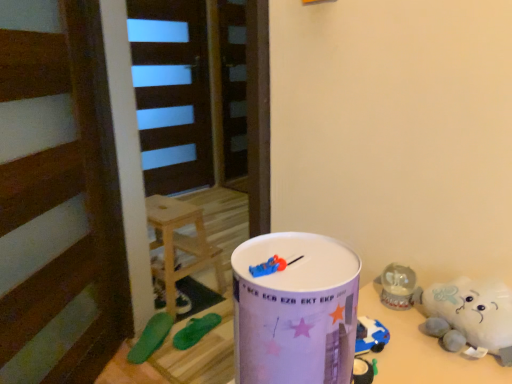
The image size is (512, 384). Describe the element at coordinates (179, 250) in the screenshot. I see `wooden stool at center` at that location.

Describe the element at coordinates (151, 337) in the screenshot. I see `green rubber toy at lower left, which ranks as the first toy in front-to-back order` at that location.

This screenshot has height=384, width=512. I want to click on green rubber toy at lower left, which is the 1th toy in back-to-front order, so click(x=159, y=294).

From the picture: Is white glossy milk can at center to the right of green rubber toy at lower left, marked as the third toy in a back-to-front arrangement, from the viewer's perspective?

Correct, you'll find white glossy milk can at center to the right of green rubber toy at lower left, marked as the third toy in a back-to-front arrangement.

Is white glossy milk can at center aimed at green rubber toy at lower left, marked as the third toy in a back-to-front arrangement?

No, white glossy milk can at center is not aimed at green rubber toy at lower left, marked as the third toy in a back-to-front arrangement.

From a real-world perspective, is white glossy milk can at center positioned under green rubber toy at lower left, which ranks as the first toy in front-to-back order, based on gravity?

No, from a real-world perspective, white glossy milk can at center is not under green rubber toy at lower left, which ranks as the first toy in front-to-back order.

Is white plush toy at lower right positioned beyond the bounds of white glossy milk can at center?

Yes, white plush toy at lower right is located beyond the bounds of white glossy milk can at center.

Considering the relative sizes of white plush toy at lower right and white glossy milk can at center in the image provided, is white plush toy at lower right taller than white glossy milk can at center?

No.

Considering the sizes of objects wooden stool at center and white glossy milk can at center in the image provided, who is bigger, wooden stool at center or white glossy milk can at center?

With larger size is wooden stool at center.

Is point (188, 300) closer to viewer compared to point (340, 263)?

No, (188, 300) is further to viewer.

Looking at this image, in terms of width, does wooden stool at center look wider or thinner when compared to white glossy milk can at center?

In the image, wooden stool at center appears to be wider than white glossy milk can at center.

Considering the positions of objects green rubber toy at lower left, which is the 1th toy in back-to-front order, and green rubber toy at lower left, marked as the third toy in a back-to-front arrangement, in the image provided, who is in front, green rubber toy at lower left, which is the 1th toy in back-to-front order, or green rubber toy at lower left, marked as the third toy in a back-to-front arrangement,?

green rubber toy at lower left, marked as the third toy in a back-to-front arrangement, is in front.

Would you say green rubber toy at lower left, which is the 1th toy in back-to-front order, contains green rubber toy at lower left, marked as the third toy in a back-to-front arrangement?

No, green rubber toy at lower left, marked as the third toy in a back-to-front arrangement, is not a part of green rubber toy at lower left, which is the 1th toy in back-to-front order.

From a real-world perspective, is green rubber toy at lower left, which is the 1th toy in back-to-front order, on green rubber toy at lower left, which ranks as the first toy in front-to-back order?

No, from a real-world perspective, green rubber toy at lower left, which is the 1th toy in back-to-front order, is not over green rubber toy at lower left, which ranks as the first toy in front-to-back order

Is green rubber toy at lower left, marked as the third toy in a back-to-front arrangement, inside or outside of white plush toy at lower right?

green rubber toy at lower left, marked as the third toy in a back-to-front arrangement, lies outside white plush toy at lower right.

Is point (166, 325) positioned before point (395, 338)?

No, it is not.

How distant is green rubber toy at lower left, which ranks as the first toy in front-to-back order, from white plush toy at lower right?

green rubber toy at lower left, which ranks as the first toy in front-to-back order, and white plush toy at lower right are 4.41 feet apart from each other.

Does green rubber toy at lower left, marked as the third toy in a back-to-front arrangement, turn towards white plush toy at lower right?

No, green rubber toy at lower left, marked as the third toy in a back-to-front arrangement, is not oriented towards white plush toy at lower right.

This screenshot has width=512, height=384. Identify the location of table above the green rubber toy at lower left, which is the 1th toy in back-to-front order (from the image's perspective). (422, 350).

From the image's perspective, which one is positioned lower, green rubber toy at lower left, which is the 1th toy in back-to-front order, or white plush toy at lower right?

green rubber toy at lower left, which is the 1th toy in back-to-front order.

From a real-world perspective, is green rubber toy at lower left, which is the 1th toy in back-to-front order, on top of white plush toy at lower right?

No, from a real-world perspective, green rubber toy at lower left, which is the 1th toy in back-to-front order, is not over white plush toy at lower right

From their relative heights in the image, would you say green rubber toy at lower left, which is the 1th toy in back-to-front order, is taller or shorter than white plush toy at lower right?

Considering their sizes, green rubber toy at lower left, which is the 1th toy in back-to-front order, has less height than white plush toy at lower right.

Looking at this image, from the image's perspective, is white plush toy at lower right above or below green rubber flip-flops at lower left, the 2th toy positioned from the front?

From the image's perspective, white plush toy at lower right appears above green rubber flip-flops at lower left, the 2th toy positioned from the front.

Which object is wider, white plush toy at lower right or green rubber flip-flops at lower left, the 2th toy viewed from the back?

green rubber flip-flops at lower left, the 2th toy viewed from the back.

From the picture: Considering the relative positions of white plush toy at lower right and green rubber flip-flops at lower left, the 2th toy viewed from the back, in the image provided, is white plush toy at lower right to the left or to the right of green rubber flip-flops at lower left, the 2th toy viewed from the back,?

Clearly, white plush toy at lower right is on the right of green rubber flip-flops at lower left, the 2th toy viewed from the back, in the image.

Does white plush toy at lower right turn towards green rubber flip-flops at lower left, the 2th toy positioned from the front?

No, white plush toy at lower right is not oriented towards green rubber flip-flops at lower left, the 2th toy positioned from the front.

Find the location of `milk can in front of the green rubber toy at lower left, which ranks as the first toy in front-to-back order`. milk can in front of the green rubber toy at lower left, which ranks as the first toy in front-to-back order is located at coordinates (295, 311).

What are the coordinates of `milk can above the white plush toy at lower right (from the image's perspective)` in the screenshot? It's located at (295, 311).

Looking at the image, which one is located further to white plush toy at lower right, white glossy milk can at center or green rubber toy at lower left, which ranks as the first toy in front-to-back order?

Among the two, green rubber toy at lower left, which ranks as the first toy in front-to-back order, is located further to white plush toy at lower right.

Looking at the image, which one is located further to white glossy milk can at center, white plush toy at lower right or green rubber flip-flops at lower left, the 2th toy viewed from the back?

green rubber flip-flops at lower left, the 2th toy viewed from the back, lies further to white glossy milk can at center than the other object.

Considering their positions, is green rubber flip-flops at lower left, the 2th toy viewed from the back, positioned further to white glossy milk can at center than green rubber toy at lower left, which is the 1th toy in back-to-front order?

The object further to white glossy milk can at center is green rubber toy at lower left, which is the 1th toy in back-to-front order.

Which object lies further to the anchor point white glossy milk can at center, green rubber toy at lower left, which is the 1th toy in back-to-front order, or green rubber toy at lower left, which ranks as the first toy in front-to-back order?

green rubber toy at lower left, which is the 1th toy in back-to-front order, lies further to white glossy milk can at center than the other object.

Considering their positions, is green rubber toy at lower left, which ranks as the first toy in front-to-back order, positioned closer to wooden stool at center than white plush toy at lower right?

Based on the image, green rubber toy at lower left, which ranks as the first toy in front-to-back order, appears to be nearer to wooden stool at center.

When comparing their distances from green rubber toy at lower left, arranged as the third toy when viewed from the front, does wooden stool at center or green rubber flip-flops at lower left, the 2th toy positioned from the front, seem closer?

Based on the image, wooden stool at center appears to be nearer to green rubber toy at lower left, arranged as the third toy when viewed from the front.

Considering their positions, is white plush toy at lower right positioned closer to green rubber toy at lower left, marked as the third toy in a back-to-front arrangement, than white glossy milk can at center?

white plush toy at lower right is closer to green rubber toy at lower left, marked as the third toy in a back-to-front arrangement.

When comparing their distances from white plush toy at lower right, does green rubber toy at lower left, marked as the third toy in a back-to-front arrangement, or white glossy milk can at center seem closer?

Among the two, white glossy milk can at center is located nearer to white plush toy at lower right.

What are the coordinates of `furniture between green rubber toy at lower left, which ranks as the first toy in front-to-back order, and green rubber toy at lower left, which is the 1th toy in back-to-front order, from front to back` in the screenshot? It's located at (179, 250).

Find the location of a particular element. The height and width of the screenshot is (384, 512). table located between white glossy milk can at center and green rubber flip-flops at lower left, the 2th toy viewed from the back, in the depth direction is located at coordinates (422, 350).

At what (x,y) coordinates should I click in order to perform the action: click on furniture between white glossy milk can at center and green rubber toy at lower left, which is the 1th toy in back-to-front order, in the front-back direction. Please return your answer as a coordinate pair (x, y). Looking at the image, I should click on (179, 250).

Where is `toy between wooden stool at center and green rubber flip-flops at lower left, the 2th toy positioned from the front, in the up-down direction`? toy between wooden stool at center and green rubber flip-flops at lower left, the 2th toy positioned from the front, in the up-down direction is located at coordinates (159, 294).